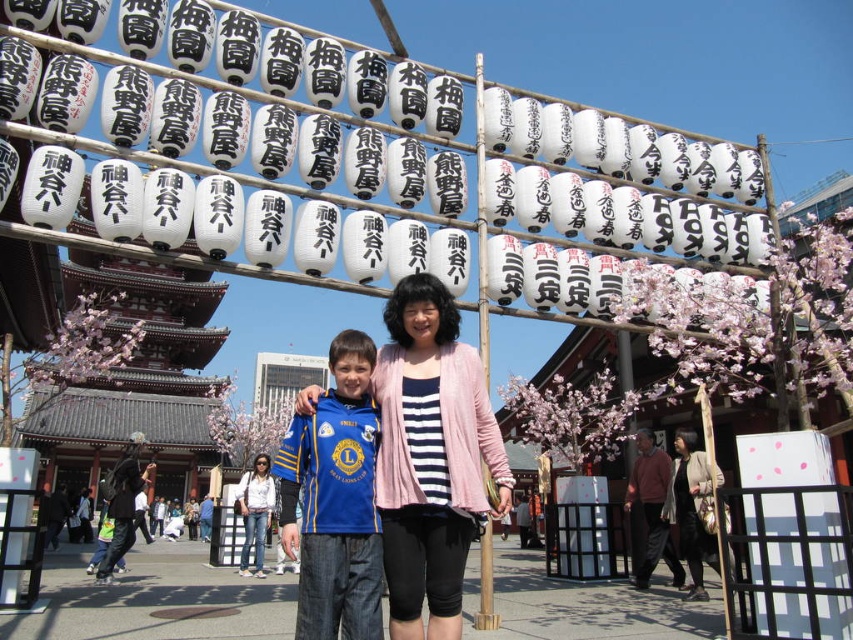
Is point (316, 579) less distant than point (677, 436)?

Yes, point (316, 579) is closer to viewer.

Does blue jersey at center appear over matte black jacket at center?

Correct, blue jersey at center is located above matte black jacket at center.

Which is behind, point (341, 596) or point (680, 458)?

Point (680, 458)

Image resolution: width=853 pixels, height=640 pixels. What are the coordinates of `blue jersey at center` in the screenshot? It's located at (335, 500).

Does matte black jacket at center appear on the left side of denim jacket at lower center?

No, matte black jacket at center is not to the left of denim jacket at lower center.

Is point (685, 451) less distant than point (260, 497)?

Yes, point (685, 451) is in front of point (260, 497).

Locate an element on the screen. The height and width of the screenshot is (640, 853). matte black jacket at center is located at coordinates (692, 509).

Which is above, blue jersey at center or denim jacket at lower center?

Positioned higher is blue jersey at center.

Locate an element on the screen. This screenshot has width=853, height=640. blue jersey at center is located at coordinates (335, 500).

Where is `blue jersey at center`? The image size is (853, 640). blue jersey at center is located at coordinates (335, 500).